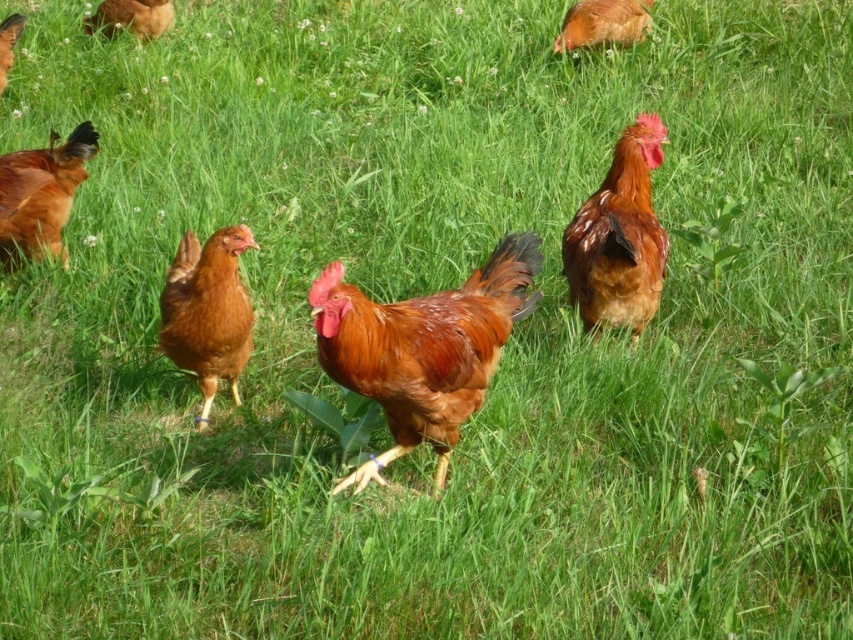
You are standing in the field and want to pick up an object located at point (x=215, y=294) and another object at point (x=38, y=209). Which point is closer to you?

Point (x=215, y=294) is closer to the camera than point (x=38, y=209), so the object at point (x=215, y=294) is closer to you.

You are standing in the field and see the point marked at coordinates (x=207, y=310). What is the closest object to that point?

The closest object to the point marked at coordinates (x=207, y=310) is the matte brown chicken at center, which is located exactly at that point.